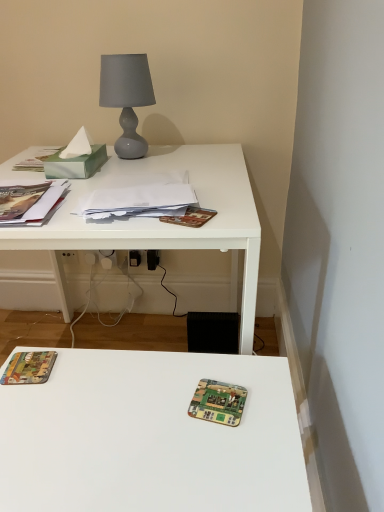
Locate an element on the screen. Image resolution: width=384 pixels, height=512 pixels. vacant space positioned to the left of brown textured paper at center, arranged as the second paperback book when viewed from the left is located at coordinates (121, 220).